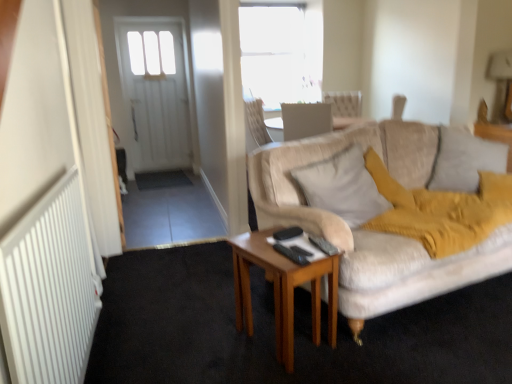
You are a GUI agent. You are given a task and a screenshot of the screen. Output one action in this format:
    pyautogui.click(x=<x>, y=<y>)
    Task: Click on the free space that is to the left of black plastic remote control at center, the 2th remote control in the back-to-front sequence
    This screenshot has height=384, width=512.
    Given the screenshot: What is the action you would take?
    pyautogui.click(x=269, y=251)